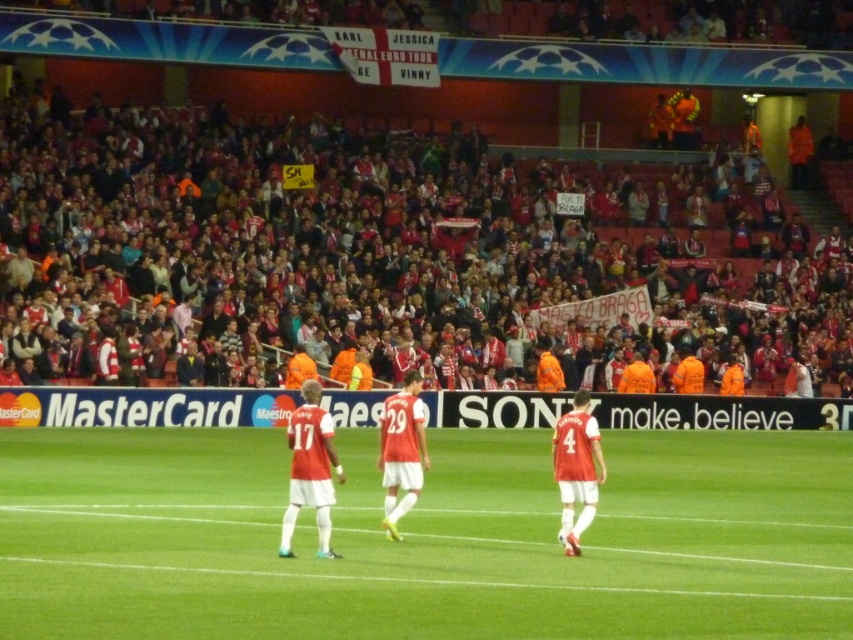
Can you confirm if red fabric crowd at upper center is bigger than green grass field at center?

Yes, red fabric crowd at upper center is bigger than green grass field at center.

Does red fabric crowd at upper center have a greater height compared to green grass field at center?

Correct, red fabric crowd at upper center is much taller as green grass field at center.

Who is more forward, (572, 163) or (62, 513)?

Point (62, 513)

This screenshot has height=640, width=853. I want to click on red fabric crowd at upper center, so click(387, 253).

Who is shorter, matte red jersey at center or red jersey at center?

Standing shorter between the two is red jersey at center.

Is matte red jersey at center to the right of red jersey at center from the viewer's perspective?

In fact, matte red jersey at center is to the left of red jersey at center.

This screenshot has width=853, height=640. Identify the location of matte red jersey at center. (310, 468).

Is green grass field at center above red matte jersey at center?

No.

Does point (518, 545) come farther from viewer compared to point (384, 504)?

No, (518, 545) is closer to viewer.

In order to click on green grass field at center in this screenshot , I will do `click(422, 538)`.